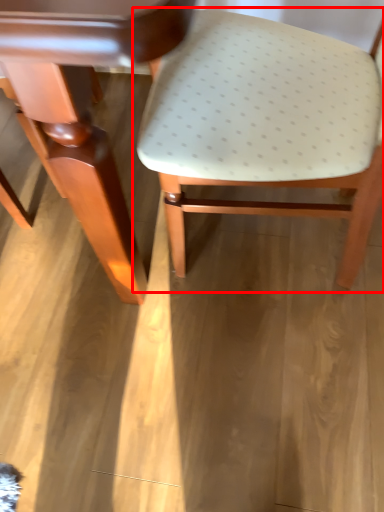
Question: From the image's perspective, what is the correct spatial relationship of chair (annotated by the red box) in relation to table?

Choices:
 (A) below
 (B) above

Answer: (A)